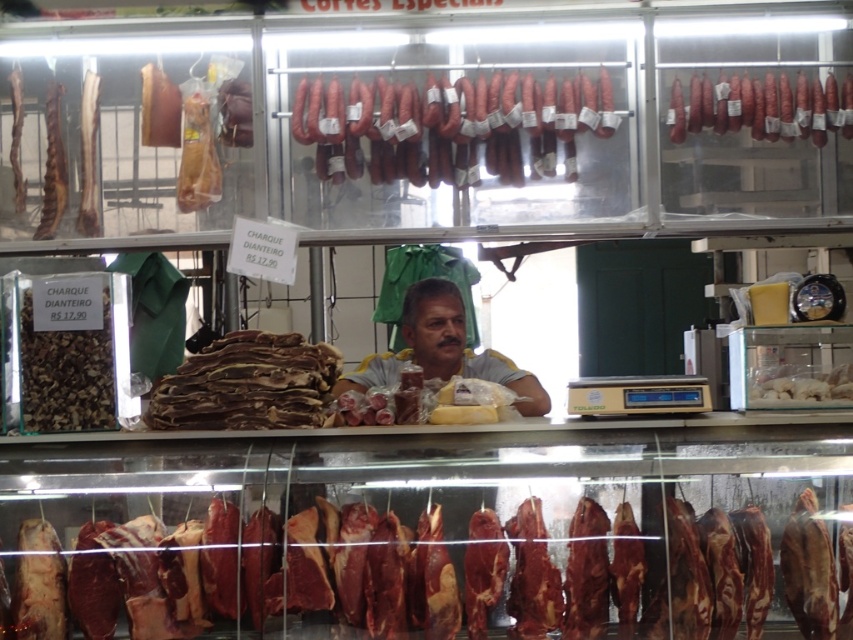
Who is lower down, brown crumbly charque at left or translucent plastic bag at center?

translucent plastic bag at center

Is brown crumbly charque at left closer to camera compared to translucent plastic bag at center?

Yes, it is in front of translucent plastic bag at center.

Which is in front, point (91, 419) or point (798, 376)?

Positioned in front is point (91, 419).

Locate an element on the screen. brown crumbly charque at left is located at coordinates (61, 355).

Between smoked pink meat at center and smoked pink sausage at upper right, which one appears on the right side from the viewer's perspective?

Positioned to the right is smoked pink sausage at upper right.

Between smoked pink meat at center and smoked pink sausage at upper right, which one appears on the left side from the viewer's perspective?

smoked pink meat at center

Locate an element on the screen. The width and height of the screenshot is (853, 640). smoked pink meat at center is located at coordinates (479, 563).

This screenshot has height=640, width=853. What are the coordinates of `smoked pink meat at center` in the screenshot? It's located at (479, 563).

How much distance is there between smoked sausage at center and smoked pink sausage at upper right?

smoked sausage at center is 22.41 inches from smoked pink sausage at upper right.

The width and height of the screenshot is (853, 640). Describe the element at coordinates (451, 125) in the screenshot. I see `smoked sausage at center` at that location.

Measure the distance between point (515, 92) and camera.

Point (515, 92) and camera are 3.82 meters apart.

The width and height of the screenshot is (853, 640). In order to click on smoked sausage at center in this screenshot , I will do `click(451, 125)`.